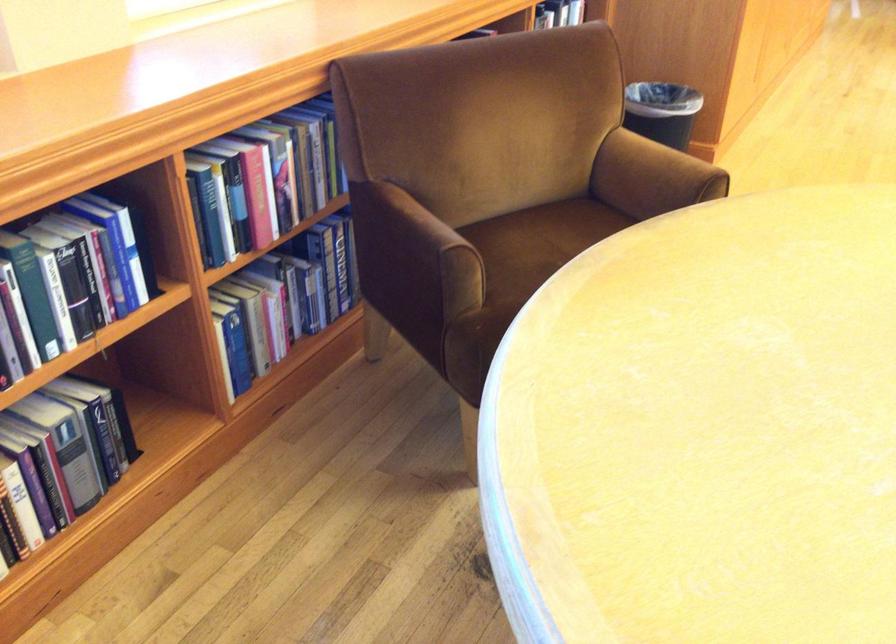
The width and height of the screenshot is (896, 644). Identify the location of black trash can. (661, 111).